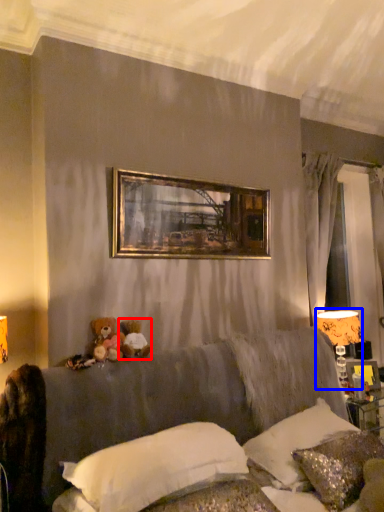
Question: Which of the following is the closest to the observer, toy (highlighted by a red box) or table lamp (highlighted by a blue box)?

Choices:
 (A) toy
 (B) table lamp

Answer: (A)